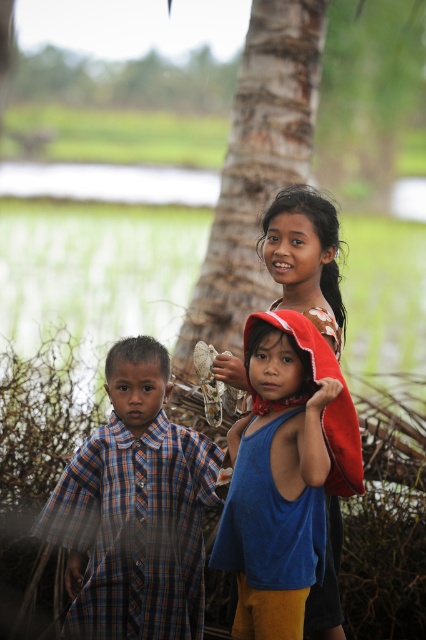
In the scene shown: Between plaid fabric shirt at left and blue fabric at center, which one is positioned lower?

Positioned lower is plaid fabric shirt at left.

Does point (146, 419) come in front of point (299, 284)?

No, it is not.

In order to click on plaid fabric shirt at left in this screenshot , I will do `click(135, 509)`.

Is point (186, 548) behind point (244, 97)?

No, it is not.

Does plaid fabric shirt at left lie behind brown rough tree trunk at center?

No, it is in front of brown rough tree trunk at center.

Between point (154, 401) and point (261, 92), which one is positioned behind?

The point (261, 92) is more distant.

Locate an element on the screen. The image size is (426, 640). plaid fabric shirt at left is located at coordinates (135, 509).

Is brown rough tree trunk at center thinner than blue fabric at center?

No.

Based on the photo, between brown rough tree trunk at center and blue fabric at center, which one has less height?

Standing shorter between the two is blue fabric at center.

The width and height of the screenshot is (426, 640). Describe the element at coordinates (256, 170) in the screenshot. I see `brown rough tree trunk at center` at that location.

The image size is (426, 640). I want to click on brown rough tree trunk at center, so click(256, 170).